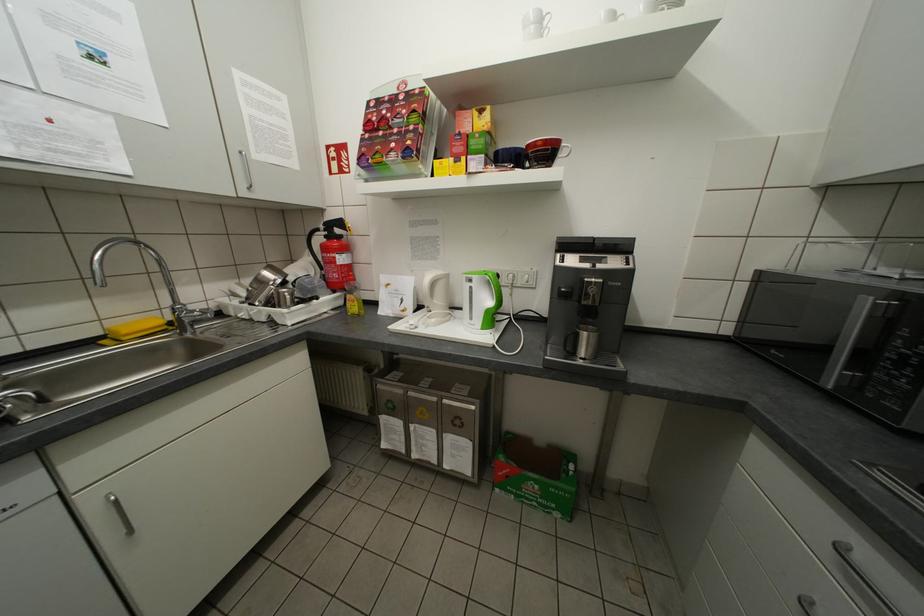
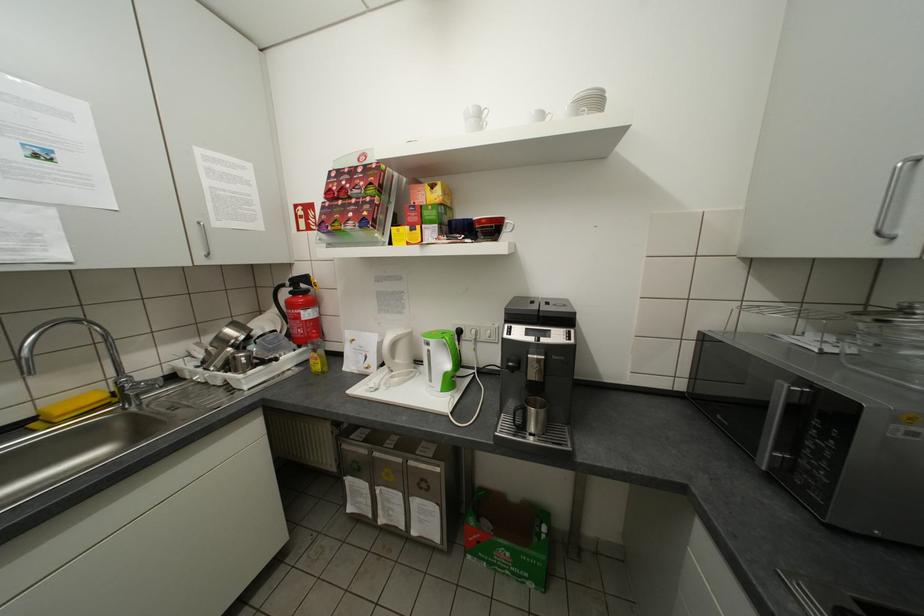
Question: I am providing you with two images of the same scene from different viewpoints. Which of the following objects are not visible in image2?

Choices:
 (A) green kettle handle
 (B) silver metal mug
 (C) yellow soap bottle
 (D) none of these

Answer: (D)